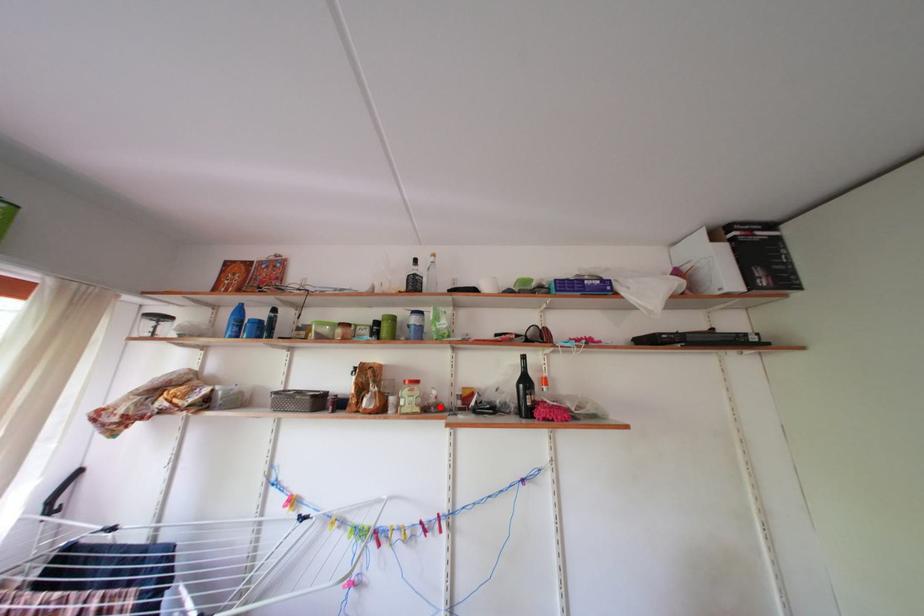
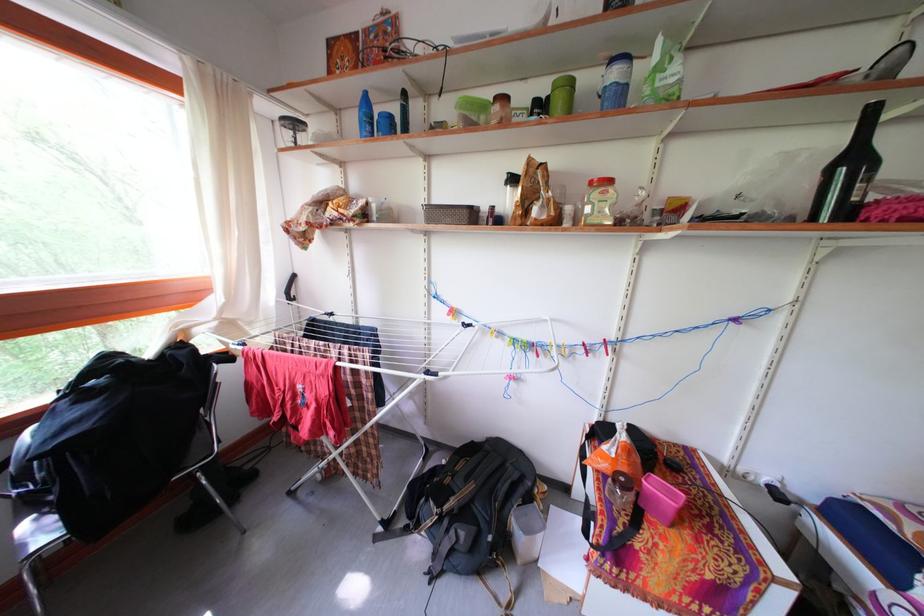
In the second image, find the point that corresponds to the highlighted location in the first image.

(638, 216)